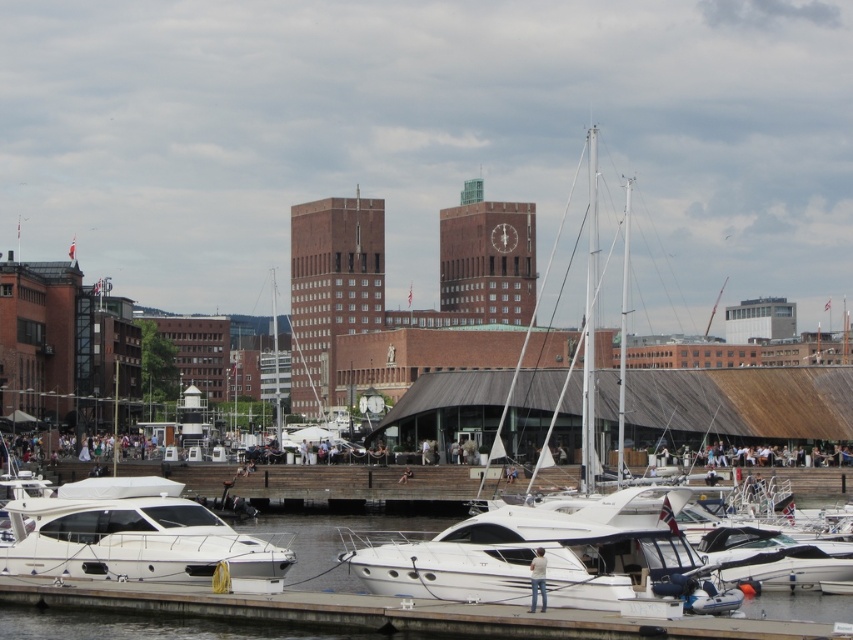
Does point (254, 541) come closer to viewer compared to point (402, 531)?

Yes, it is.

Which is behind, point (74, 538) or point (190, 630)?

Point (74, 538)

I want to click on white glossy motorboat at lower left, so tap(134, 536).

Is white glossy boat at center thinner than white glossy water at center?

Correct, white glossy boat at center's width is less than white glossy water at center's.

Which is behind, point (669, 525) or point (747, 612)?

Positioned behind is point (669, 525).

Is point (619, 582) in front of point (77, 634)?

No.

Find the location of a particular element. white glossy boat at center is located at coordinates (558, 557).

Between white glossy boat at center and white glossy motorboat at lower left, which one is positioned higher?

white glossy motorboat at lower left is above.

Does white glossy boat at center have a larger size compared to white glossy motorboat at lower left?

Yes.

What do you see at coordinates (558, 557) in the screenshot? I see `white glossy boat at center` at bounding box center [558, 557].

The height and width of the screenshot is (640, 853). Identify the location of white glossy boat at center. (558, 557).